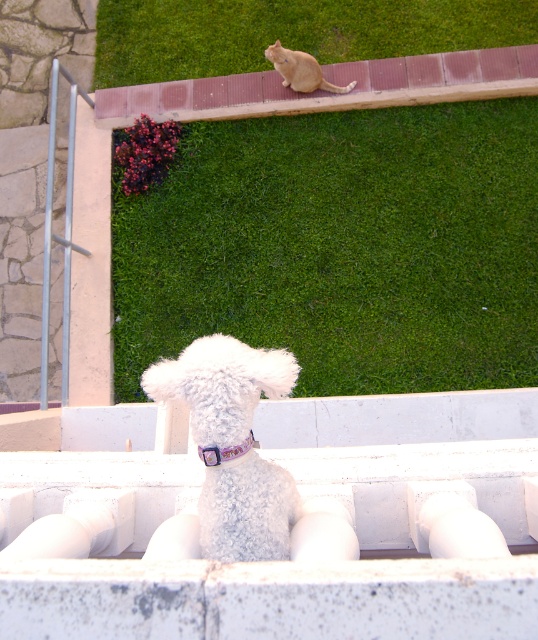
Does white fluffy dog at center lie in front of purple satin neckband at center?

Yes.

I want to click on white fluffy dog at center, so click(232, 444).

This screenshot has height=640, width=538. In order to click on white fluffy dog at center in this screenshot , I will do `click(232, 444)`.

What do you see at coordinates (232, 444) in the screenshot?
I see `white fluffy dog at center` at bounding box center [232, 444].

Is white fluffy dog at center thinner than white fluffy dog at upper center?

Correct, white fluffy dog at center's width is less than white fluffy dog at upper center's.

Find the location of a particular element. white fluffy dog at center is located at coordinates (232, 444).

Between green grass at upper center and white fluffy dog at upper center, which one has more height?

Standing taller between the two is green grass at upper center.

Can you confirm if green grass at upper center is bigger than white fluffy dog at upper center?

Yes, green grass at upper center is bigger than white fluffy dog at upper center.

What are the coordinates of `green grass at upper center` in the screenshot? It's located at (342, 248).

Identify the location of green grass at upper center. The height and width of the screenshot is (640, 538). (342, 248).